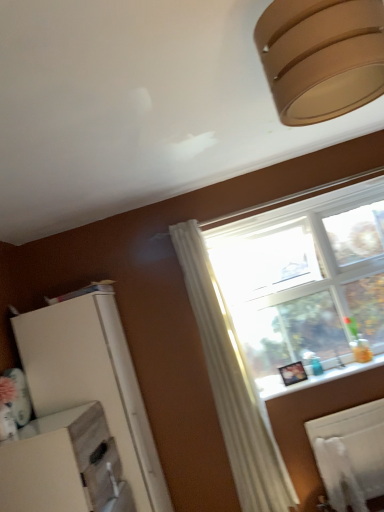
Question: Can you confirm if white matte radiator at lower right is wider than matte brown lampshade at upper right?

Choices:
 (A) yes
 (B) no

Answer: (B)

Question: From a real-world perspective, is white matte radiator at lower right positioned over matte brown lampshade at upper right based on gravity?

Choices:
 (A) no
 (B) yes

Answer: (A)

Question: Is matte brown lampshade at upper right completely or partially inside white matte radiator at lower right?

Choices:
 (A) yes
 (B) no

Answer: (B)

Question: Could you tell me if white matte radiator at lower right is facing matte brown lampshade at upper right?

Choices:
 (A) no
 (B) yes

Answer: (A)

Question: Does white matte radiator at lower right appear on the right side of matte brown lampshade at upper right?

Choices:
 (A) yes
 (B) no

Answer: (A)

Question: From the image's perspective, relative to white matte dresser at lower left, is white glossy window sill at lower right above or below?

Choices:
 (A) above
 (B) below

Answer: (A)

Question: In terms of height, does white glossy window sill at lower right look taller or shorter compared to white matte dresser at lower left?

Choices:
 (A) tall
 (B) short

Answer: (B)

Question: Relative to white matte dresser at lower left, is white glossy window sill at lower right in front or behind?

Choices:
 (A) behind
 (B) front

Answer: (A)

Question: Is white glossy window sill at lower right wider or thinner than white matte dresser at lower left?

Choices:
 (A) thin
 (B) wide

Answer: (A)

Question: Is matte brown lampshade at upper right to the left or to the right of white matte radiator at lower right in the image?

Choices:
 (A) right
 (B) left

Answer: (B)

Question: Looking at their shapes, would you say matte brown lampshade at upper right is wider or thinner than white matte radiator at lower right?

Choices:
 (A) thin
 (B) wide

Answer: (B)

Question: Considering their positions, is matte brown lampshade at upper right located in front of or behind white matte radiator at lower right?

Choices:
 (A) behind
 (B) front

Answer: (B)

Question: Considering the positions of point (357, 7) and point (350, 439), is point (357, 7) closer or farther from the camera than point (350, 439)?

Choices:
 (A) closer
 (B) farther

Answer: (A)

Question: In terms of height, does matte brown lampshade at upper right look taller or shorter compared to white matte dresser at lower left?

Choices:
 (A) tall
 (B) short

Answer: (B)

Question: Looking at their shapes, would you say matte brown lampshade at upper right is wider or thinner than white matte dresser at lower left?

Choices:
 (A) thin
 (B) wide

Answer: (A)